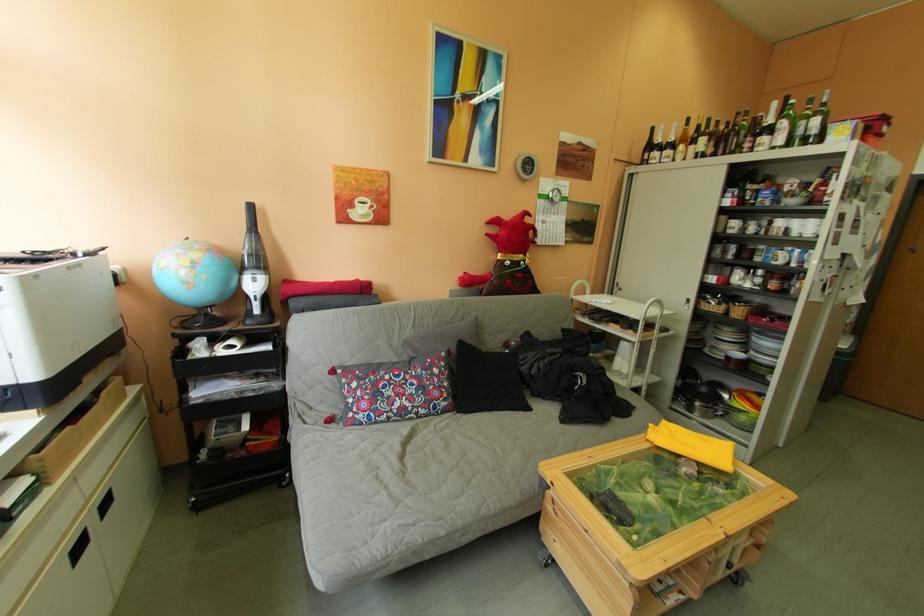
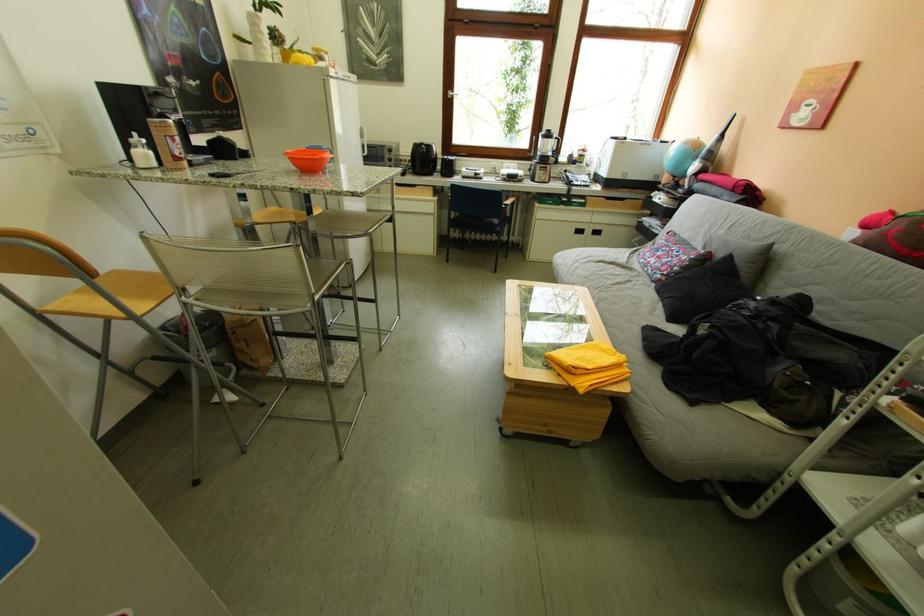
Locate, in the second image, the point that corresponds to (x=117, y=251) in the first image.

(687, 145)